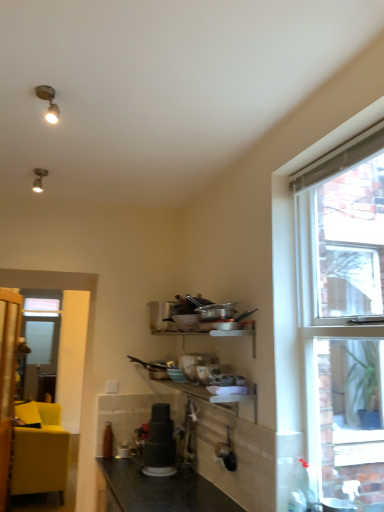
Question: From the image's perspective, is matte yellow couch at left located above or below clear glass window at upper right?

Choices:
 (A) below
 (B) above

Answer: (A)

Question: In terms of height, does matte yellow couch at left look taller or shorter compared to clear glass window at upper right?

Choices:
 (A) tall
 (B) short

Answer: (B)

Question: Considering the real-world distances, which object is farthest from the clear glass window at upper right?

Choices:
 (A) matte black blender at center
 (B) matte yellow couch at left
 (C) black granite countertop at lower center

Answer: (B)

Question: Estimate the real-world distances between objects in this image. Which object is farther from the clear glass window at upper right?

Choices:
 (A) black granite countertop at lower center
 (B) matte yellow couch at left
 (C) matte black blender at center

Answer: (B)